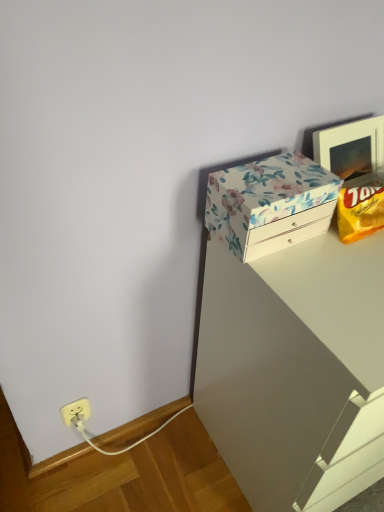
I want to click on unoccupied region to the right of floral paper-covered box at upper right, so click(x=345, y=253).